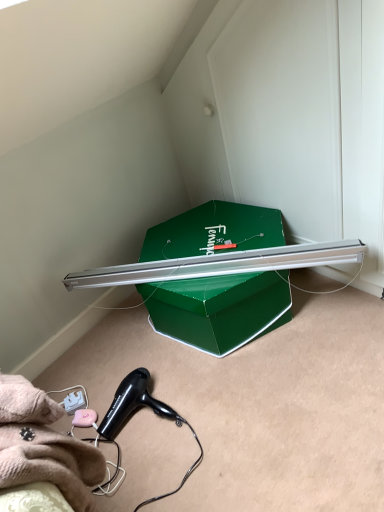
Where is `vacant space underneath black plastic hair dryer at lower left (from a real-world perspective)`? Image resolution: width=384 pixels, height=512 pixels. vacant space underneath black plastic hair dryer at lower left (from a real-world perspective) is located at coordinates (161, 414).